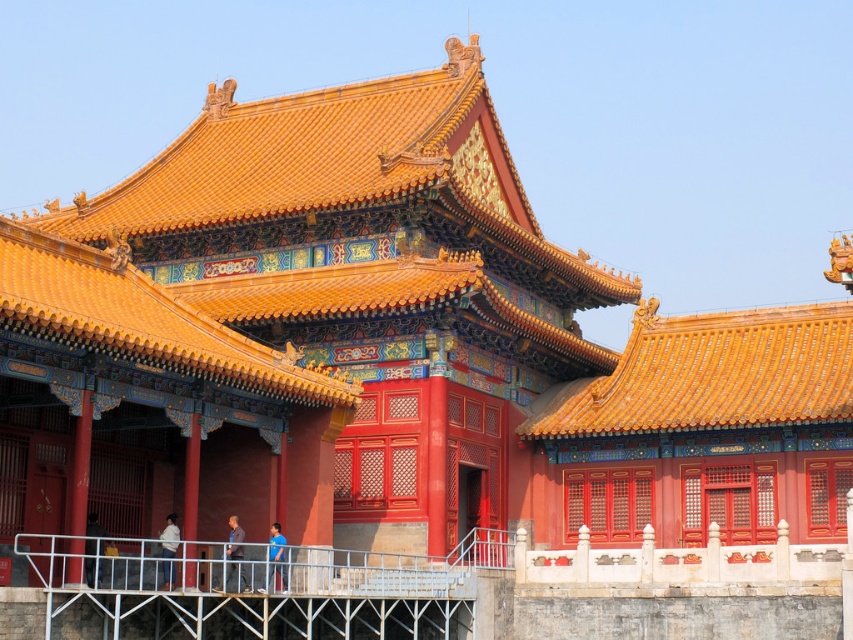
Looking at this image, between blue fabric shirt at center and matte black person at lower left, which one appears on the left side from the viewer's perspective?

matte black person at lower left

Is point (276, 560) farther from camera compared to point (86, 538)?

Yes, point (276, 560) is behind point (86, 538).

Identify the location of blue fabric shirt at center. This screenshot has width=853, height=640. (276, 557).

Who is positioned more to the right, metallic gray railing at lower center or blue fabric shirt at center?

Positioned to the right is blue fabric shirt at center.

Who is taller, metallic gray railing at lower center or blue fabric shirt at center?

Standing taller between the two is metallic gray railing at lower center.

Is point (0, 545) closer to viewer compared to point (285, 564)?

Yes, it is in front of point (285, 564).

You are a GUI agent. You are given a task and a screenshot of the screen. Output one action in this format:
    pyautogui.click(x=<x>, y=<y>)
    Task: Click on the metallic gray railing at lower center
    
    Given the screenshot: What is the action you would take?
    pyautogui.click(x=234, y=593)

Between point (397, 600) and point (241, 548), which one is positioned behind?

The point (241, 548) is more distant.

Does metallic gray railing at lower center have a greater height compared to dark blue shirt at center?

Yes, metallic gray railing at lower center is taller than dark blue shirt at center.

This screenshot has height=640, width=853. I want to click on metallic gray railing at lower center, so click(234, 593).